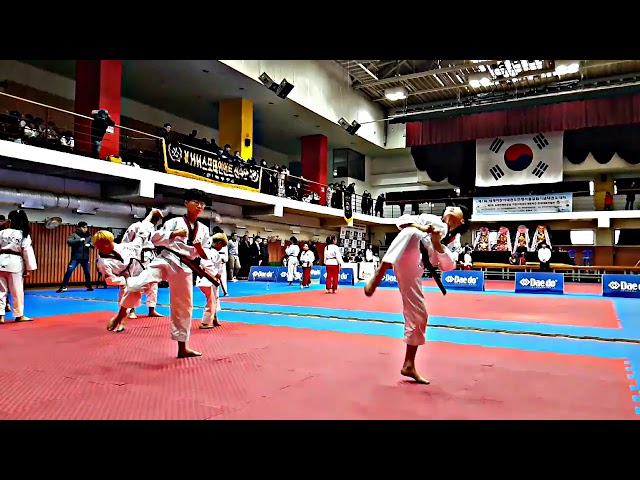
I want to click on red mat, so click(x=316, y=381), click(x=492, y=301), click(x=580, y=289).